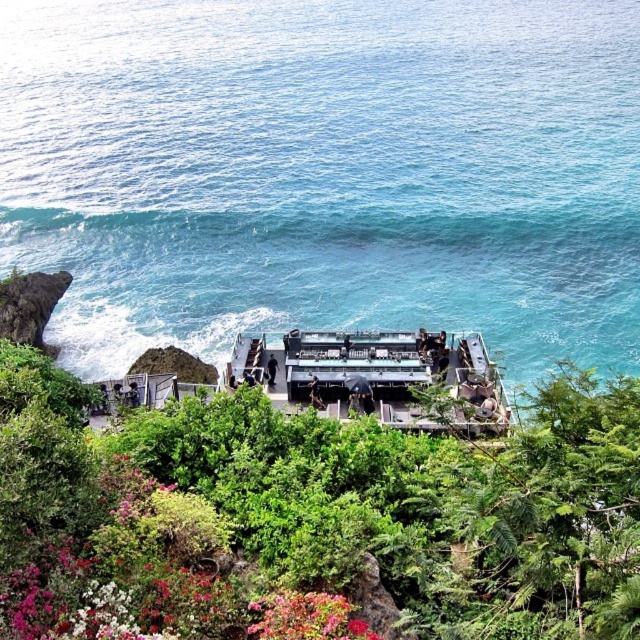
Question: Which object is the farthest from the vibrant red petals at lower center?

Choices:
 (A) metallic gray boat at center
 (B) green leafy foliage at center
 (C) blue water at center

Answer: (C)

Question: Which point is closer to the camera taking this photo?

Choices:
 (A) click(x=150, y=227)
 (B) click(x=323, y=632)
 (C) click(x=323, y=410)

Answer: (B)

Question: Observing the image, what is the correct spatial positioning of green leafy foliage at center in reference to vibrant red petals at lower center?

Choices:
 (A) left
 (B) right

Answer: (A)

Question: Can you confirm if blue water at center is positioned to the right of vibrant red petals at lower center?

Choices:
 (A) no
 (B) yes

Answer: (B)

Question: Based on their relative distances, which object is nearer to the metallic gray boat at center?

Choices:
 (A) vibrant red petals at lower center
 (B) green leafy foliage at center
 (C) blue water at center

Answer: (B)

Question: Does blue water at center have a greater width compared to green leafy foliage at center?

Choices:
 (A) yes
 (B) no

Answer: (A)